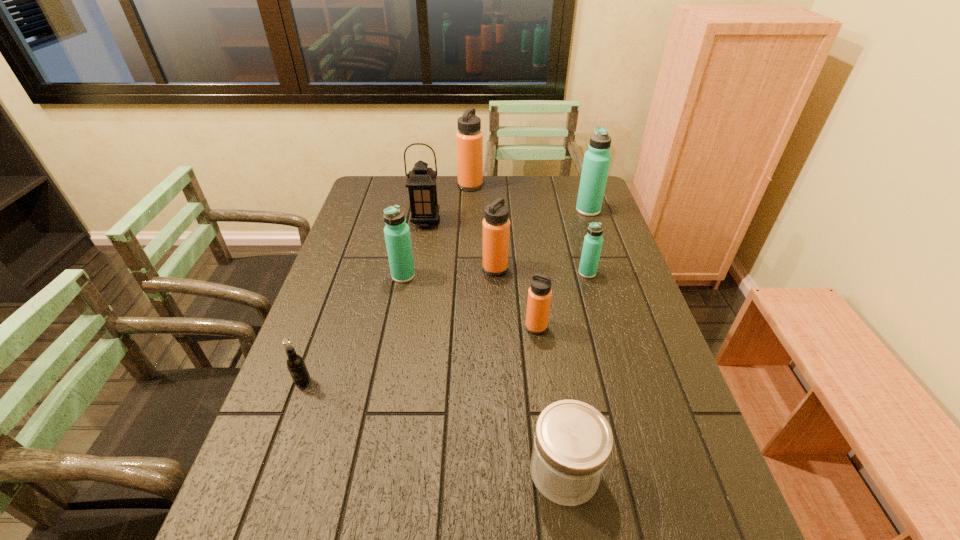
Find the location of a particular element. Image resolution: width=960 pixels, height=540 pixels. vacant space situated 0.100m on the left of the rightmost orange thermos bottle is located at coordinates (488, 327).

Find the location of a particular element. vacant space located 0.310m on the left of the nearest object is located at coordinates (375, 471).

I want to click on vacant space located on the label of the root beer, so click(263, 494).

The height and width of the screenshot is (540, 960). In order to click on object present at the left edge in this screenshot , I will do `click(295, 363)`.

Locate an element on the screen. object at the far right corner is located at coordinates (596, 163).

I want to click on vacant space at the far edge, so click(x=521, y=189).

This screenshot has height=540, width=960. In the image, there is a desktop. In order to click on free space at the left edge in this screenshot , I will do `click(349, 248)`.

At what (x,y) coordinates should I click in order to perform the action: click on vacant region at the right edge. Please return your answer as a coordinate pair (x, y). This screenshot has height=540, width=960. Looking at the image, I should click on (596, 308).

The height and width of the screenshot is (540, 960). What are the coordinates of `free space at the far left corner of the desktop` in the screenshot? It's located at (380, 197).

Identify the location of empty location between the nearest object and the fifth nearest thermos bottle. (576, 341).